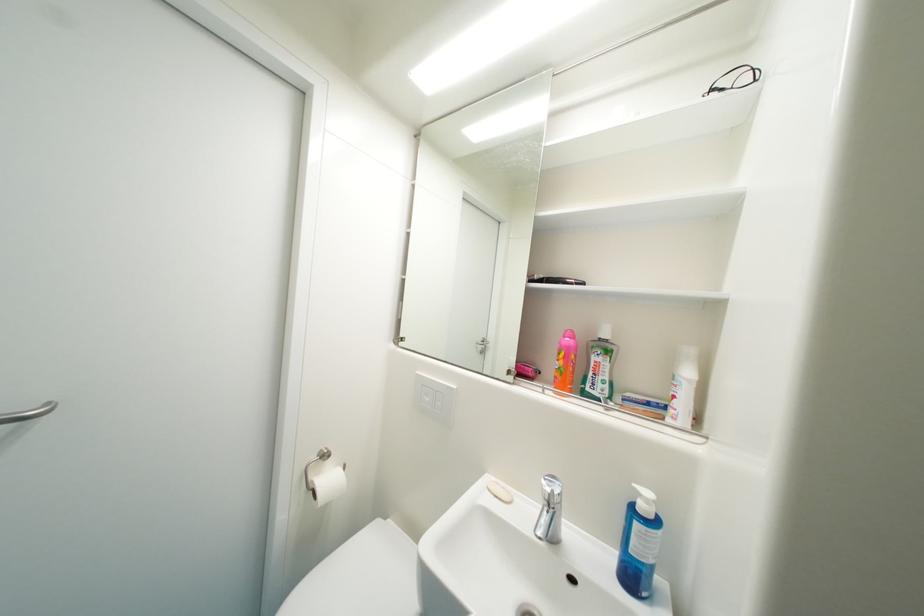
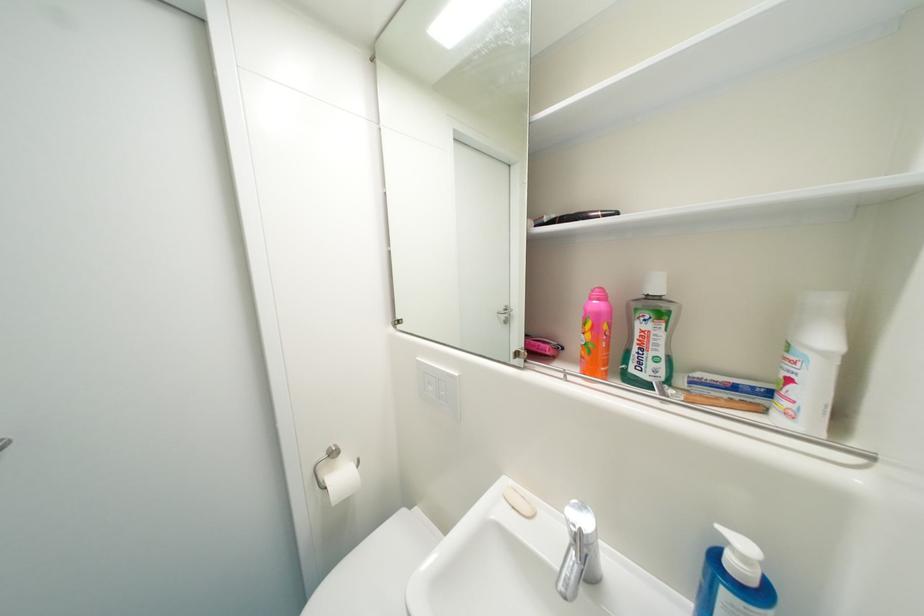
Which direction would the cameraman need to move to produce the second image?

The cameraman walked toward right, forward.